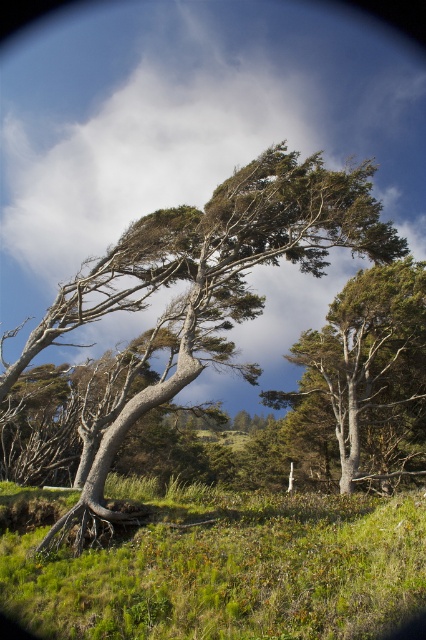
Question: Does green grassy at lower left come behind gray bark tree at center?

Choices:
 (A) yes
 (B) no

Answer: (B)

Question: Which of the following is the farthest from the observer?

Choices:
 (A) green textured tree at center
 (B) green grassy at lower left

Answer: (A)

Question: Which object is the closest to the gray bark tree at center?

Choices:
 (A) green grassy at lower left
 (B) green textured tree at center

Answer: (A)

Question: Among these objects, which one is nearest to the camera?

Choices:
 (A) green grassy at lower left
 (B) green textured tree at center
 (C) gray bark tree at center

Answer: (A)

Question: Can you confirm if green grassy at lower left is positioned above green textured tree at center?

Choices:
 (A) no
 (B) yes

Answer: (A)

Question: Does gray bark tree at center appear under green textured tree at center?

Choices:
 (A) yes
 (B) no

Answer: (B)